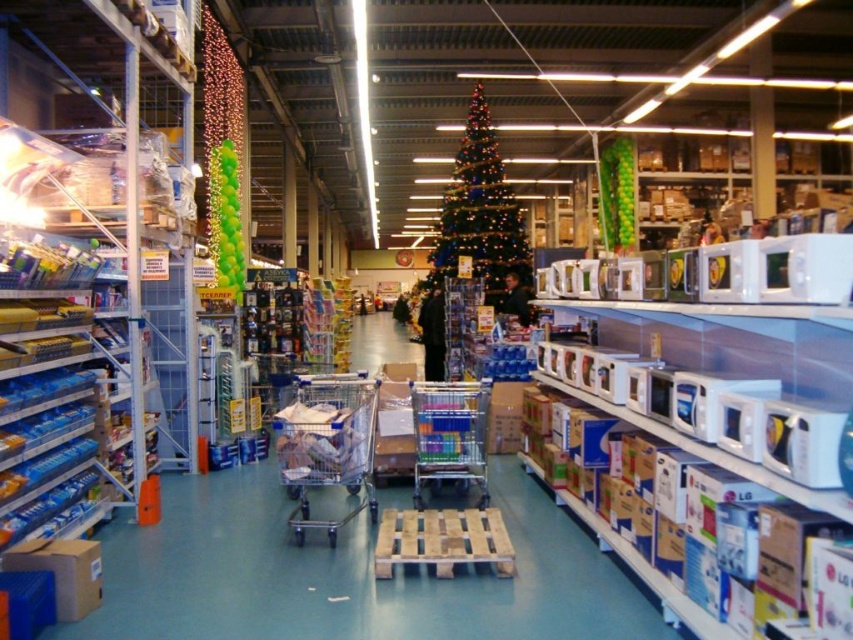
How distant is metallic silver shopping cart at center from chrome metallic shopping cart at center?

metallic silver shopping cart at center is 24.49 inches from chrome metallic shopping cart at center.

Is metallic silver shopping cart at center above chrome metallic shopping cart at center?

Yes, metallic silver shopping cart at center is above chrome metallic shopping cart at center.

You are a GUI agent. You are given a task and a screenshot of the screen. Output one action in this format:
    pyautogui.click(x=<x>, y=<y>)
    Task: Click on the metallic silver shopping cart at center
    This screenshot has height=640, width=853.
    Given the screenshot: What is the action you would take?
    pyautogui.click(x=328, y=444)

Can you confirm if green glittering christmas tree at center is positioned to the left of metallic silver shopping cart at center?

No, green glittering christmas tree at center is not to the left of metallic silver shopping cart at center.

Can you confirm if green glittering christmas tree at center is smaller than metallic silver shopping cart at center?

No.

What do you see at coordinates (483, 220) in the screenshot?
I see `green glittering christmas tree at center` at bounding box center [483, 220].

This screenshot has width=853, height=640. I want to click on green glittering christmas tree at center, so click(483, 220).

Is green glittering christmas tree at center above chrome metallic shopping cart at center?

Yes.

Does green glittering christmas tree at center appear under chrome metallic shopping cart at center?

No.

Is point (457, 166) more distant than point (476, 419)?

Yes, point (457, 166) is behind point (476, 419).

At what (x,y) coordinates should I click in order to perform the action: click on green glittering christmas tree at center. Please return your answer as a coordinate pair (x, y). Image resolution: width=853 pixels, height=640 pixels. Looking at the image, I should click on click(x=483, y=220).